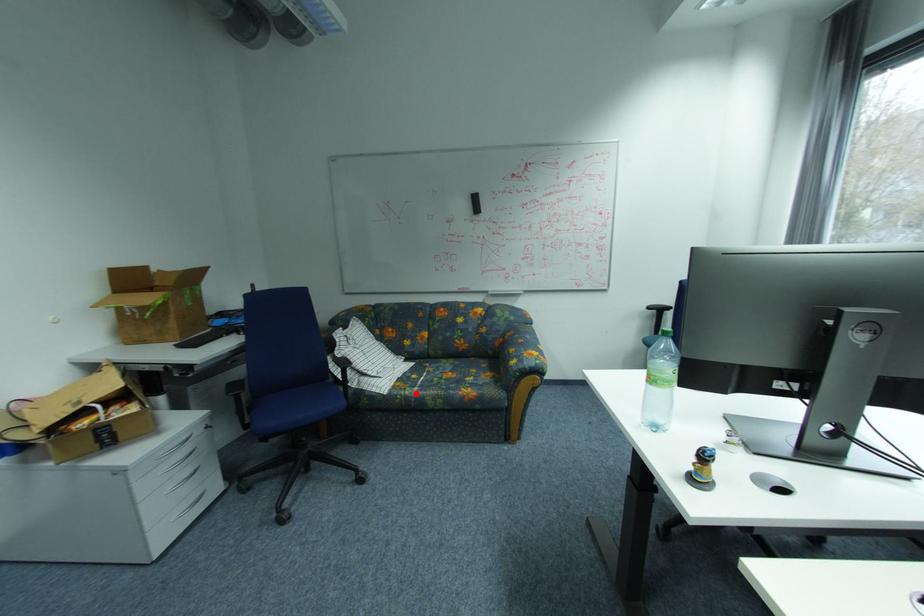
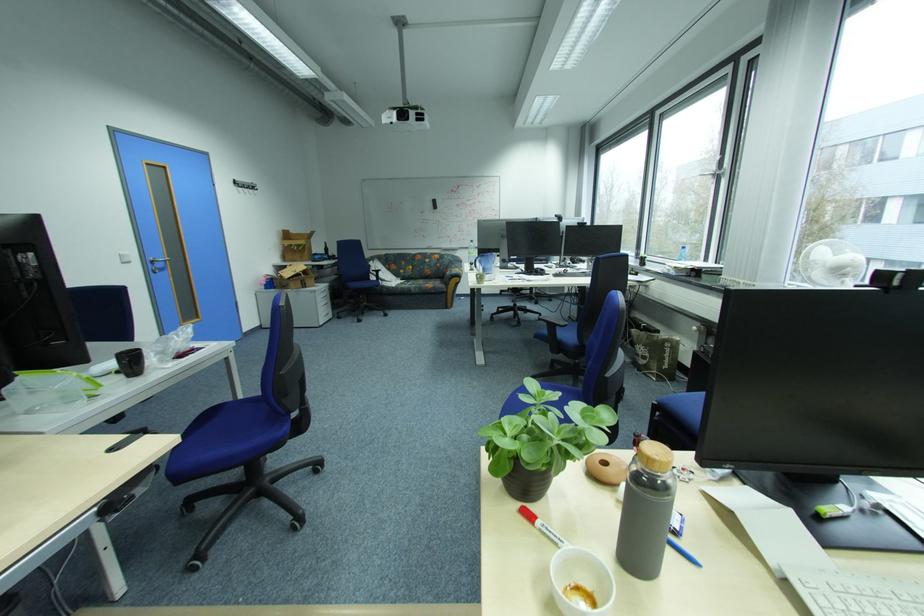
Question: I am providing you with two images of the same scene from different viewpoints. A red point is shown in image1. For the corresponding object point in image2, is it positioned nearer or farther from the camera?

Choices:
 (A) Nearer
 (B) Farther

Answer: (A)